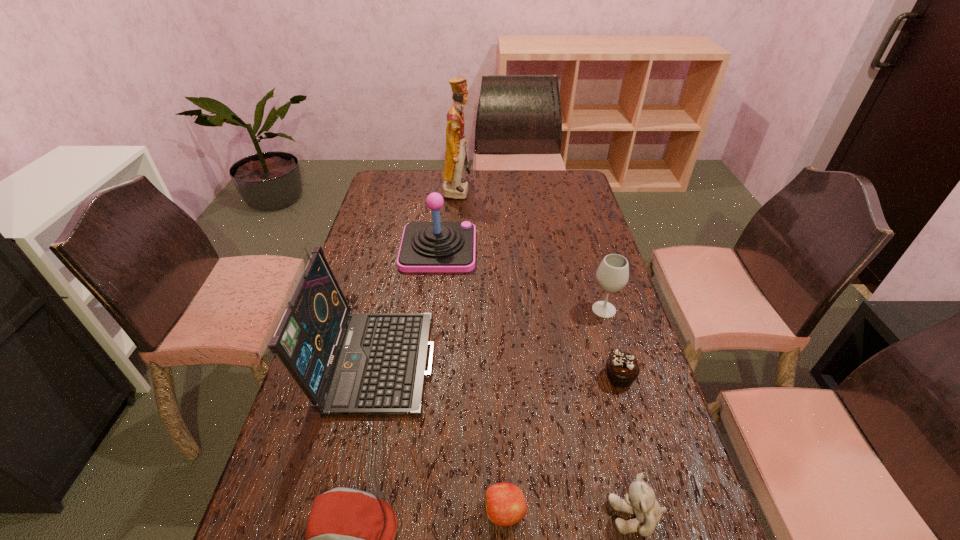
Find the location of a particular element. vacant space at the far left corner is located at coordinates (382, 170).

In the image, there is a desktop. Where is `vacant space at the far right corner`? The image size is (960, 540). vacant space at the far right corner is located at coordinates (564, 188).

This screenshot has width=960, height=540. What are the coordinates of `vacant area between the nutcracker and the laptop computer` in the screenshot? It's located at (417, 274).

The height and width of the screenshot is (540, 960). I want to click on blank region between the apple and the laptop computer, so click(441, 435).

You are a GUI agent. You are given a task and a screenshot of the screen. Output one action in this format:
    pyautogui.click(x=<x>, y=<y>)
    Task: Click on the free spot between the joystick and the cupcake
    
    Given the screenshot: What is the action you would take?
    529,313

You are a GUI agent. You are given a task and a screenshot of the screen. Output one action in this format:
    pyautogui.click(x=<x>, y=<y>)
    Task: Click on the free space between the cupcake and the tallest object
    The height and width of the screenshot is (540, 960).
    Given the screenshot: What is the action you would take?
    pyautogui.click(x=539, y=284)

Where is `the second closest object relative to the teddy bear`? The width and height of the screenshot is (960, 540). the second closest object relative to the teddy bear is located at coordinates (622, 367).

Where is `object that ranks as the third closest to the fourth tallest object`? The image size is (960, 540). object that ranks as the third closest to the fourth tallest object is located at coordinates (347, 363).

Locate an element on the screen. free point that satisfies the following two spatial constraints: 1. on the front-facing side of the cupcake; 2. on the left side of the seventh shortest object is located at coordinates (372, 377).

Locate an element on the screen. This screenshot has width=960, height=540. free space that satisfies the following two spatial constraints: 1. forward from the base of the cupcake; 2. on the left side of the second farthest object is located at coordinates (423, 377).